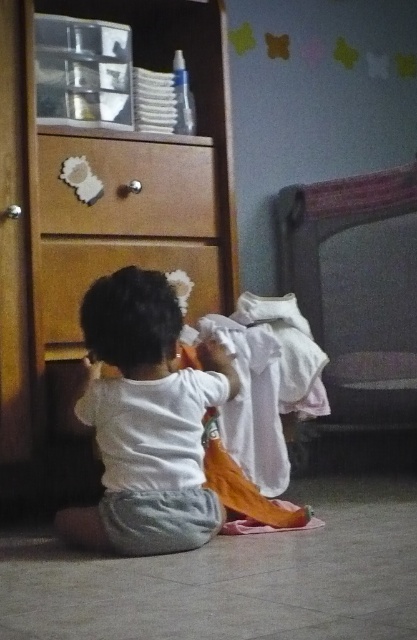
You are helping a child organize their room. The wooden dresser at left has two drawers. The child wants to place the white cotton shirt at lower center into the top drawer. Can the shirt fit vertically inside the drawer if the shirt is as tall as the drawer?

The wooden dresser at left is taller than the white cotton shirt at lower center. Since the shirt is as tall as the drawer, it might not fit vertically because the dresser itself is taller than the shirt, implying the drawer may be shorter than the shirt.

You are trying to place a new item on the wooden dresser at left. According to the scene description, where exactly is the wooden dresser positioned?

The wooden dresser at left is located at point 0.356 in the x coordinate and 0.235 in the y coordinate.

You are helping a child organize their room. The child wants to place a new toy box between the dark gray fabric bunk bed at right and the wooden drawer at center. Can the toy box be placed there without overlapping either object?

The dark gray fabric bunk bed at right is below the wooden drawer at center, so there is space between them for the toy box to be placed without overlapping either object.